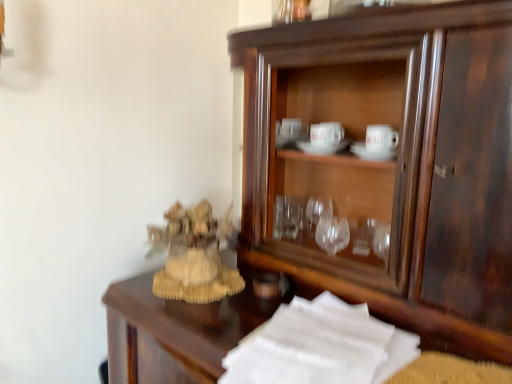
Question: Is dark wood cupboard at center in front of white paper at lower right?

Choices:
 (A) yes
 (B) no

Answer: (B)

Question: Is dark wood cupboard at center positioned far away from white paper at lower right?

Choices:
 (A) no
 (B) yes

Answer: (A)

Question: Considering the relative sizes of dark wood cupboard at center and white paper at lower right in the image provided, is dark wood cupboard at center thinner than white paper at lower right?

Choices:
 (A) no
 (B) yes

Answer: (B)

Question: From a real-world perspective, is dark wood cupboard at center on top of white paper at lower right?

Choices:
 (A) no
 (B) yes

Answer: (B)

Question: From the image's perspective, is dark wood cupboard at center over white paper at lower right?

Choices:
 (A) yes
 (B) no

Answer: (A)

Question: Does dark wood cupboard at center have a greater height compared to white paper at lower right?

Choices:
 (A) no
 (B) yes

Answer: (B)

Question: Can we say white paper at lower right lies outside beige woven statue at left?

Choices:
 (A) yes
 (B) no

Answer: (A)

Question: Would you say white paper at lower right contains beige woven statue at left?

Choices:
 (A) yes
 (B) no

Answer: (B)

Question: Is white paper at lower right next to beige woven statue at left?

Choices:
 (A) yes
 (B) no

Answer: (B)

Question: Is white paper at lower right facing towards beige woven statue at left?

Choices:
 (A) no
 (B) yes

Answer: (A)

Question: Does white paper at lower right have a lesser width compared to beige woven statue at left?

Choices:
 (A) no
 (B) yes

Answer: (A)

Question: Are white paper at lower right and beige woven statue at left far apart?

Choices:
 (A) no
 (B) yes

Answer: (A)

Question: Is beige woven statue at left completely or partially outside of dark wood cupboard at center?

Choices:
 (A) yes
 (B) no

Answer: (A)